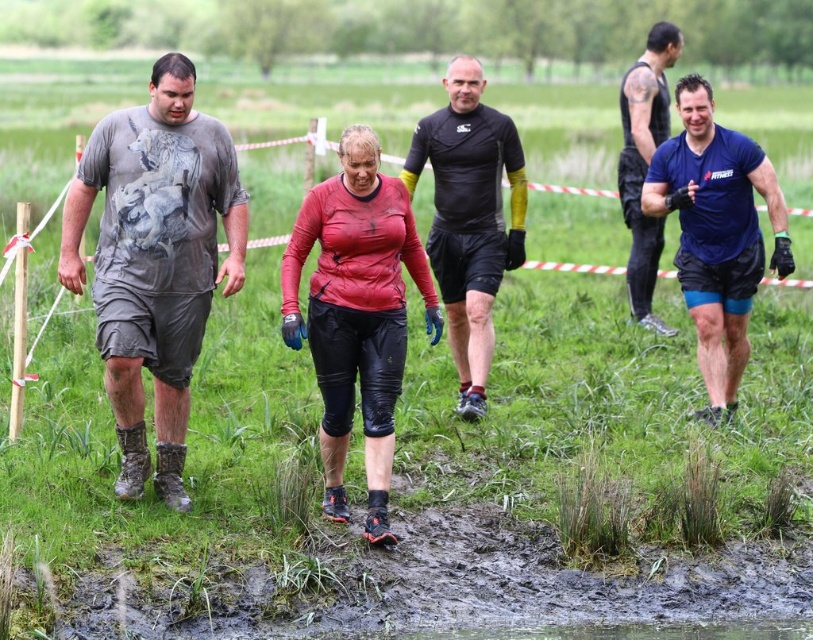
You are a photographer at the obstacle course event. You need to take a photo of the dirty gray shorts at left and the black matte shorts at center. Which of the two shorts is positioned lower in the image?

The dirty gray shorts at left is below black matte shorts at center, so the dirty gray shorts at left is positioned lower in the image.

Consider the image. You are a photographer positioned behind the group of participants in the mud run. You want to take a photo that focuses on the dirty gray shorts at left and the black matte shorts at center. Which pair of shorts will appear larger in the photo?

The dirty gray shorts at left will appear larger in the photo because they are closer to the viewer than the black matte shorts at center.